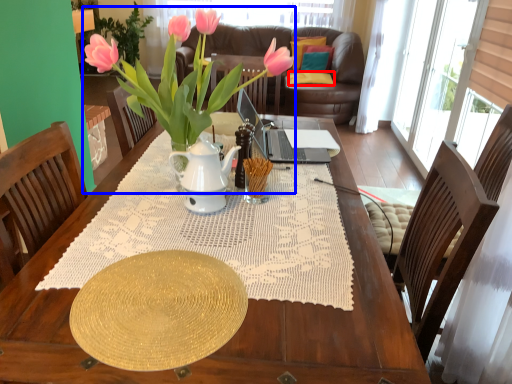
Question: Among these objects, which one is nearest to the camera, pillow (highlighted by a red box) or houseplant (highlighted by a blue box)?

Choices:
 (A) pillow
 (B) houseplant

Answer: (B)